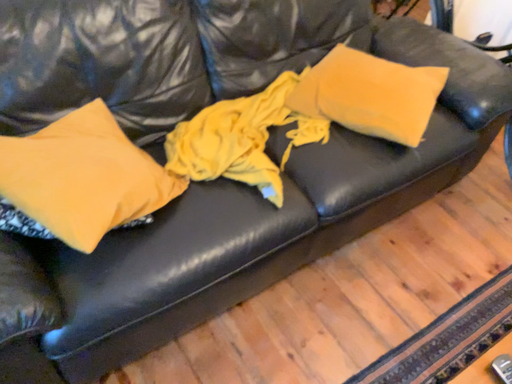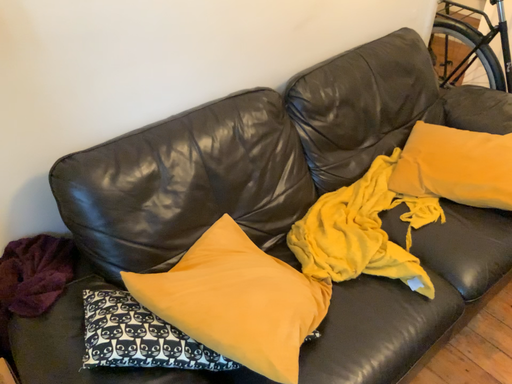
Question: How did the camera likely rotate when shooting the video?

Choices:
 (A) rotated downward
 (B) rotated upward

Answer: (B)